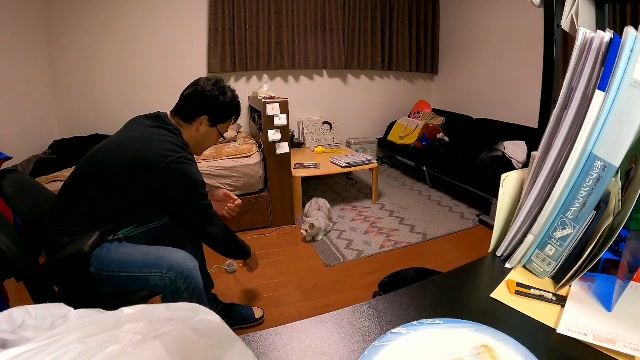
This screenshot has height=360, width=640. What are the coordinates of `brown hardwood floor` in the screenshot? It's located at (305, 286).